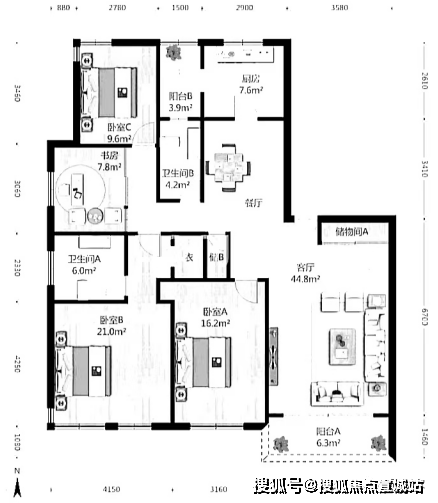
At what (x,y) coordinates should I click in order to perform the action: click on dining table. Please return your answer as a coordinate pair (x, y). Image resolution: width=438 pixels, height=503 pixels. Looking at the image, I should click on (230, 170).